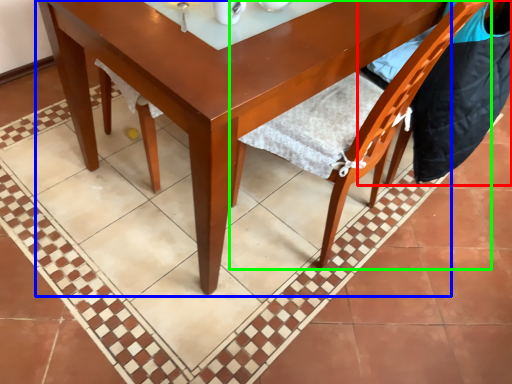
Question: Estimate the real-world distances between objects in this image. Which object is farther from chair (highlighted by a red box), round table (highlighted by a blue box) or chair (highlighted by a green box)?

Choices:
 (A) round table
 (B) chair

Answer: (A)